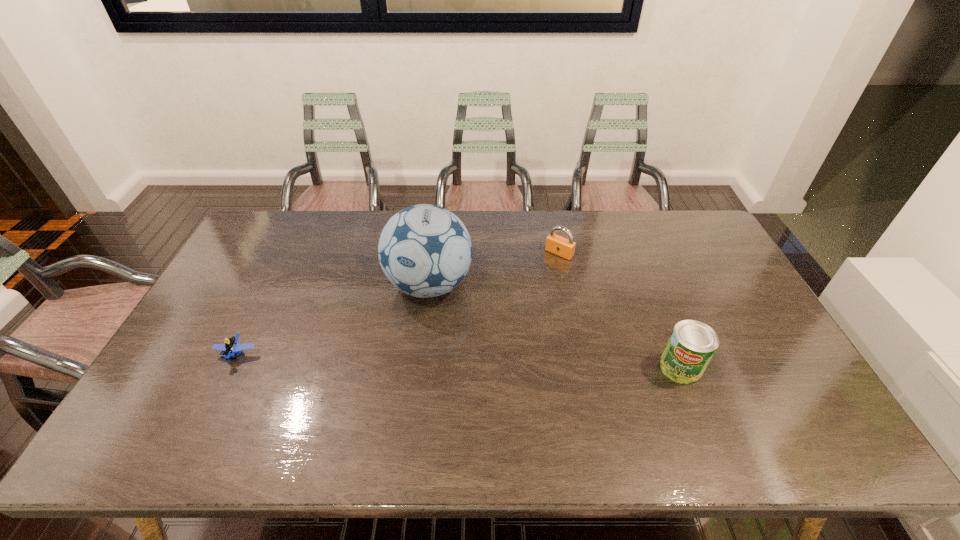
You are a GUI agent. You are given a task and a screenshot of the screen. Output one action in this format:
    pyautogui.click(x=<x>, y=<y>)
    Task: Click on the shortest object
    The height and width of the screenshot is (540, 960).
    Given the screenshot: What is the action you would take?
    pyautogui.click(x=231, y=346)

Image resolution: width=960 pixels, height=540 pixels. Find the location of `the leftmost object`. the leftmost object is located at coordinates (231, 346).

Locate an element on the screen. The image size is (960, 540). can is located at coordinates (692, 344).

Locate an element on the screen. The image size is (960, 540). the second tallest object is located at coordinates (692, 344).

You are a GUI agent. You are given a task and a screenshot of the screen. Output one action in this format:
    pyautogui.click(x=<x>, y=<y>)
    Task: Click on the padlock
    Image resolution: width=960 pixels, height=540 pixels.
    Given the screenshot: What is the action you would take?
    pyautogui.click(x=563, y=247)

Find the location of a particular element. The width and height of the screenshot is (960, 540). the third tallest object is located at coordinates (563, 247).

Locate an element on the screen. soccer ball is located at coordinates (425, 251).

Image resolution: width=960 pixels, height=540 pixels. I want to click on the third object from right to left, so click(x=425, y=251).

Identify the location of vacant space positioned 0.110m on the front-facing side of the shortest object. This screenshot has width=960, height=540. (212, 405).

The width and height of the screenshot is (960, 540). I want to click on vacant space situated on the left of the can, so click(547, 368).